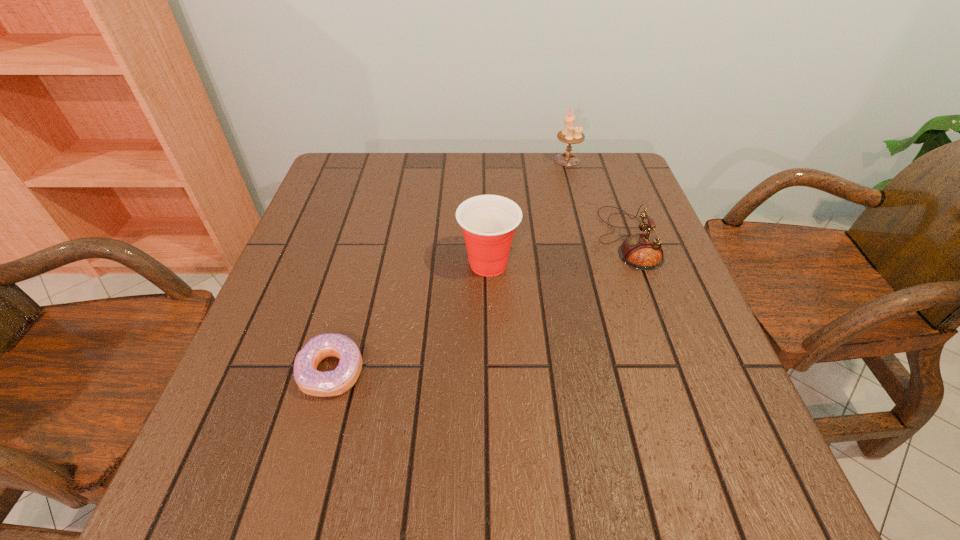
Locate an element on the screen. The image size is (960, 540). vacant space at the far left corner of the desktop is located at coordinates (329, 180).

Locate an element on the screen. Image resolution: width=960 pixels, height=540 pixels. vacant position at the near left corner of the desktop is located at coordinates (211, 469).

In the image, there is a desktop. Where is `free space at the far right corner`? free space at the far right corner is located at coordinates (584, 152).

Image resolution: width=960 pixels, height=540 pixels. Identify the location of unoccupied area between the second shortest object and the candle holder. (597, 199).

Locate an element on the screen. This screenshot has width=960, height=540. free space between the candle holder and the doughnut is located at coordinates (449, 266).

Identify the location of free spot between the nearest object and the third tallest object. The image size is (960, 540). (479, 305).

Locate an element on the screen. Image resolution: width=960 pixels, height=540 pixels. empty space that is in between the candle holder and the second object from left to right is located at coordinates (528, 212).

Image resolution: width=960 pixels, height=540 pixels. I want to click on free space that is in between the third tallest object and the candle holder, so click(x=597, y=199).

Where is `vacant space that's between the doughnut and the third tallest object`? This screenshot has height=540, width=960. vacant space that's between the doughnut and the third tallest object is located at coordinates (479, 305).

Image resolution: width=960 pixels, height=540 pixels. What are the coordinates of `vacant space that's between the cup and the third tallest object` in the screenshot? It's located at (558, 251).